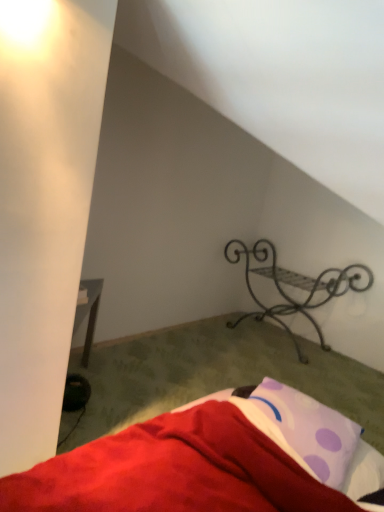
Question: Is purple dotted pillow at lower right at the back of black wrought iron shelf at upper right?

Choices:
 (A) no
 (B) yes

Answer: (A)

Question: Is black wrought iron shelf at upper right to the left of purple dotted pillow at lower right from the viewer's perspective?

Choices:
 (A) no
 (B) yes

Answer: (A)

Question: Is black wrought iron shelf at upper right taller than purple dotted pillow at lower right?

Choices:
 (A) yes
 (B) no

Answer: (A)

Question: Considering the relative positions of black wrought iron shelf at upper right and purple dotted pillow at lower right in the image provided, is black wrought iron shelf at upper right to the right of purple dotted pillow at lower right from the viewer's perspective?

Choices:
 (A) yes
 (B) no

Answer: (A)

Question: Does black wrought iron shelf at upper right lie behind purple dotted pillow at lower right?

Choices:
 (A) yes
 (B) no

Answer: (A)

Question: From a real-world perspective, is black wrought iron shelf at upper right below purple dotted pillow at lower right?

Choices:
 (A) yes
 (B) no

Answer: (A)

Question: Is purple dotted pillow at lower right in contact with red soft fabric bed at lower right?

Choices:
 (A) no
 (B) yes

Answer: (A)

Question: Can you confirm if purple dotted pillow at lower right is positioned to the right of red soft fabric bed at lower right?

Choices:
 (A) no
 (B) yes

Answer: (B)

Question: Can you confirm if purple dotted pillow at lower right is bigger than red soft fabric bed at lower right?

Choices:
 (A) yes
 (B) no

Answer: (B)

Question: Is there a large distance between purple dotted pillow at lower right and red soft fabric bed at lower right?

Choices:
 (A) no
 (B) yes

Answer: (A)

Question: From a real-world perspective, is purple dotted pillow at lower right on red soft fabric bed at lower right?

Choices:
 (A) yes
 (B) no

Answer: (A)

Question: From a real-world perspective, is purple dotted pillow at lower right positioned under red soft fabric bed at lower right based on gravity?

Choices:
 (A) yes
 (B) no

Answer: (B)

Question: Does red soft fabric bed at lower right lie behind black wrought iron shelf at upper right?

Choices:
 (A) yes
 (B) no

Answer: (B)